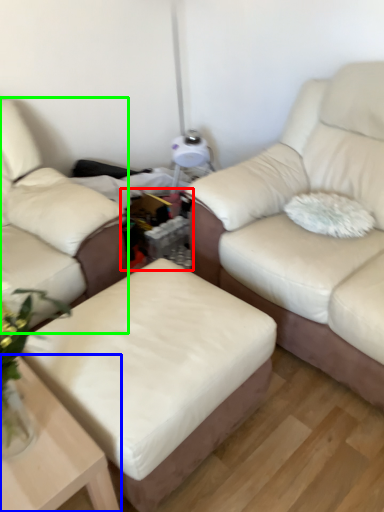
Question: Estimate the real-world distances between objects in this image. Which object is farther from cocktail table (highlighted by a red box), table (highlighted by a blue box) or studio couch (highlighted by a green box)?

Choices:
 (A) table
 (B) studio couch

Answer: (A)